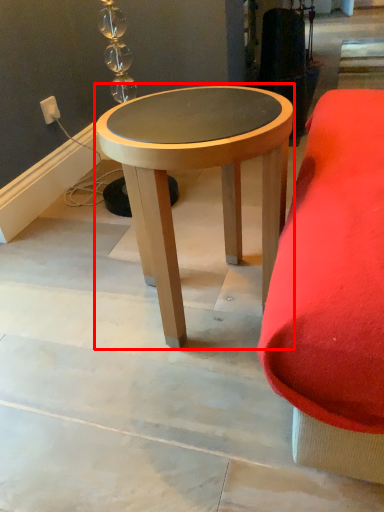
Question: From the image's perspective, what is the correct spatial positioning of coffee table (annotated by the red box) in reference to electric outlet?

Choices:
 (A) below
 (B) above

Answer: (A)